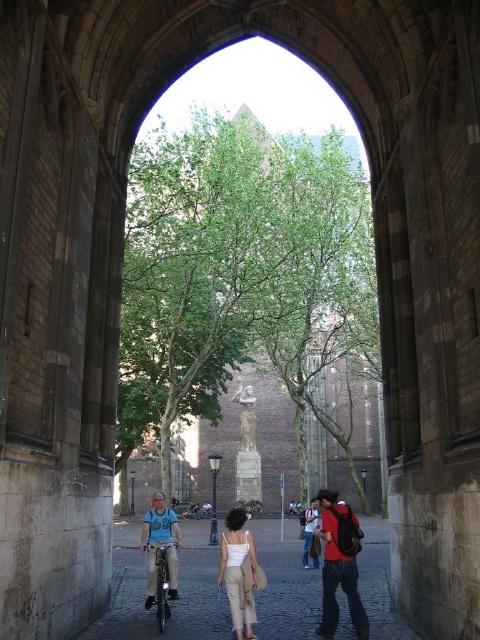
Is beige cotton pants at center smaller than denim jacket at lower center?

Actually, beige cotton pants at center might be larger than denim jacket at lower center.

Is point (240, 604) more distant than point (304, 563)?

No, (240, 604) is closer to viewer.

Does point (237, 545) lie behind point (305, 552)?

That is False.

This screenshot has width=480, height=640. What are the coordinates of `beige cotton pants at center` in the screenshot? It's located at (240, 572).

Does green leafy tree at center have a lesser height compared to matte red backpack at center?

No.

Which of these two, green leafy tree at center or matte red backpack at center, stands taller?

green leafy tree at center is taller.

Locate an element on the screen. The image size is (480, 640). green leafy tree at center is located at coordinates (241, 276).

The image size is (480, 640). Find the location of `green leafy tree at center`. green leafy tree at center is located at coordinates (241, 276).

Does matte blue shirt at center appear under smooth stone statue at center?

Yes.

Between matte blue shirt at center and smooth stone statue at center, which one has more height?

matte blue shirt at center is taller.

Find the location of a particular element. This screenshot has width=480, height=640. matte blue shirt at center is located at coordinates point(159,545).